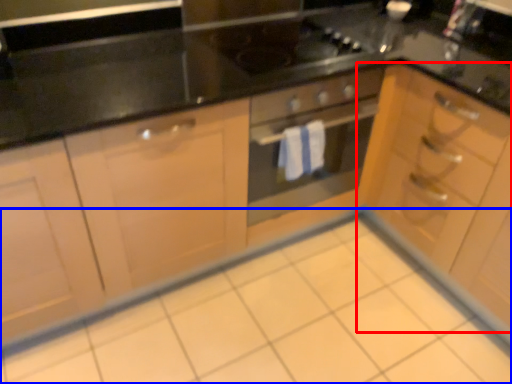
Question: Among these objects, which one is nearest to the camera, cabinetry (highlighted by a red box) or ceramic tile (highlighted by a blue box)?

Choices:
 (A) cabinetry
 (B) ceramic tile

Answer: (B)